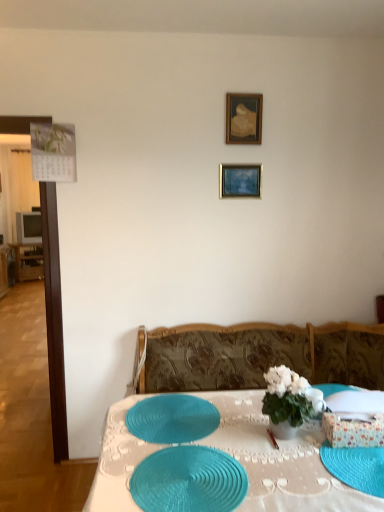
You are a GUI agent. You are given a task and a screenshot of the screen. Output one action in this format:
    pyautogui.click(x=<x>, y=<y>)
    Task: Click on the vacant area that is situated to the right of teal woven placemat at center, the first tableware in the front-to-back sequence
    Image resolution: width=384 pixels, height=512 pixels.
    Given the screenshot: What is the action you would take?
    pyautogui.click(x=296, y=484)